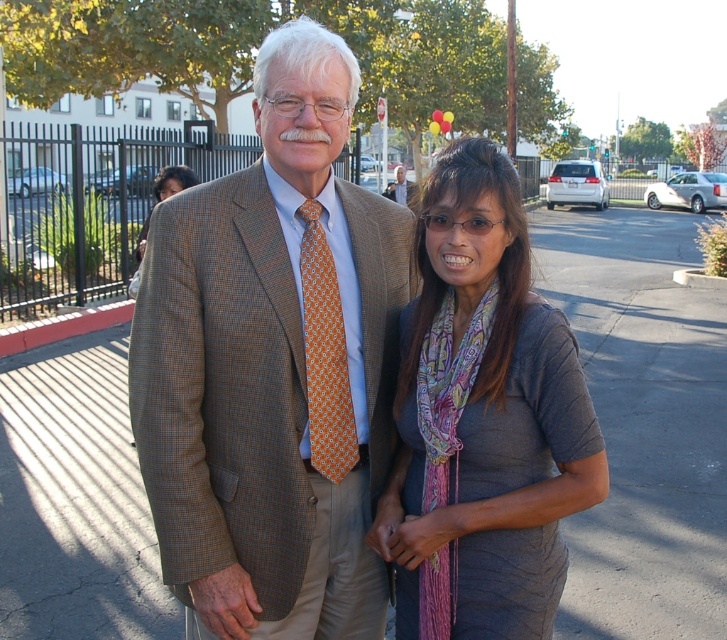
You are a photographer trying to capture a closeup of the orange printed tie at center and the orange patterned tie at center. Which tie will appear larger in the photo?

The orange printed tie at center will appear larger in the photo because it is closer to the viewer than the orange patterned tie at center.

You are a photographer trying to capture a closeup of the orange patterned tie at center without including the matte black hair at upper left in the frame. Based on their positions, is this possible?

The matte black hair at upper left is positioned under the orange patterned tie at center, so it is possible to capture a closeup of the orange patterned tie at center without including the matte black hair at upper left by adjusting the camera angle to exclude the area below the tie.

You are standing at point point (x=324, y=154) and want to take a photo of the two people in the scene. The camera you have can capture objects up to 2 meters away. Will you be able to take a clear photo of them?

The distance between point (x=324, y=154) and the camera is 1.93 meters, which is within the camera range of 2 meters. Therefore, you can take a clear photo of them.